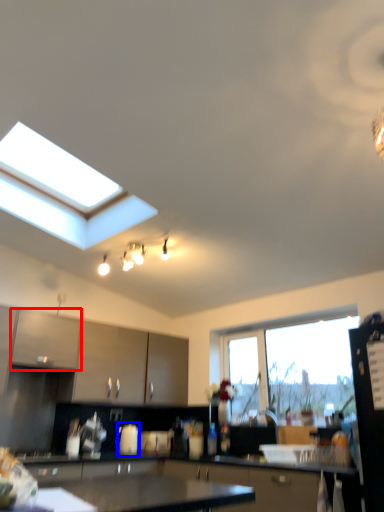
Question: Which of the following is the closest to the observer, cabinetry (highlighted by a red box) or appliance (highlighted by a blue box)?

Choices:
 (A) cabinetry
 (B) appliance

Answer: (A)